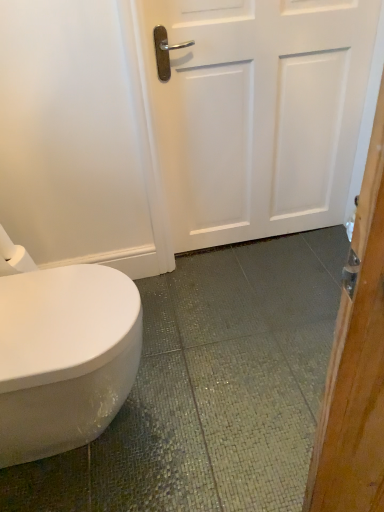
Describe the element at coordinates (13, 256) in the screenshot. I see `white matte toilet paper at left` at that location.

Find the location of a particular element. The image size is (384, 512). white matte toilet paper at left is located at coordinates (13, 256).

In order to face white matte toilet paper at left, should I rotate leftwards or rightwards?

Turn left by 24.403 degrees to look at white matte toilet paper at left.

Image resolution: width=384 pixels, height=512 pixels. What do you see at coordinates (257, 113) in the screenshot?
I see `white matte door at center` at bounding box center [257, 113].

In order to click on white matte door at center in this screenshot , I will do click(x=257, y=113).

This screenshot has height=512, width=384. I want to click on white matte toilet paper at left, so click(x=13, y=256).

Between white matte toilet paper at left and white matte door at center, which one appears on the left side from the viewer's perspective?

From the viewer's perspective, white matte toilet paper at left appears more on the left side.

Between white matte toilet paper at left and white matte door at center, which one is positioned in front?

white matte toilet paper at left.

Is point (17, 251) farther from camera compared to point (241, 99)?

No, (17, 251) is closer to viewer.

From the image's perspective, is white matte toilet paper at left located above or below white matte door at center?

Clearly, from the image's perspective, white matte toilet paper at left is below white matte door at center.

Consider the image. From a real-world perspective, is white matte toilet paper at left located beneath white matte door at center?

Yes, from a real-world perspective, white matte toilet paper at left is below white matte door at center.

Between white matte toilet paper at left and white matte door at center, which one has smaller width?

With smaller width is white matte toilet paper at left.

Is white matte toilet paper at left taller than white matte door at center?

Incorrect, the height of white matte toilet paper at left is not larger of that of white matte door at center.

Is white matte toilet paper at left bigger or smaller than white matte door at center?

Clearly, white matte toilet paper at left is smaller in size than white matte door at center.

Is white matte toilet paper at left positioned beyond the bounds of white matte door at center?

Yes, white matte toilet paper at left is not within white matte door at center.

Is white matte toilet paper at left far away from white matte door at center?

No.

Does white matte toilet paper at left turn towards white matte door at center?

No, white matte toilet paper at left is not oriented towards white matte door at center.

What's the angular difference between white matte toilet paper at left and white matte door at center's facing directions?

The angular difference between white matte toilet paper at left and white matte door at center is 0.736 degrees.

The image size is (384, 512). There is a white matte toilet paper at left. What are the coordinates of `door above it (from a real-world perspective)` in the screenshot? It's located at (257, 113).

Considering the positions of objects white matte door at center and white matte toilet paper at left in the image provided, who is more to the left, white matte door at center or white matte toilet paper at left?

Positioned to the left is white matte toilet paper at left.

Which object is more forward, white matte door at center or white matte toilet paper at left?

Positioned in front is white matte toilet paper at left.

Considering the positions of points (284, 229) and (27, 268), is point (284, 229) closer to camera compared to point (27, 268)?

No, (284, 229) is behind (27, 268).

From the image's perspective, is white matte door at center above or below white matte toilet paper at left?

white matte door at center is above white matte toilet paper at left.

From a real-world perspective, which is physically below, white matte door at center or white matte toilet paper at left?

In real-world perspective, white matte toilet paper at left is lower.

Considering the sizes of objects white matte door at center and white matte toilet paper at left in the image provided, who is thinner, white matte door at center or white matte toilet paper at left?

white matte toilet paper at left.

Is white matte door at center shorter than white matte toilet paper at left?

In fact, white matte door at center may be taller than white matte toilet paper at left.

From the picture: Which of these two, white matte door at center or white matte toilet paper at left, is bigger?

white matte door at center is bigger.

Can white matte toilet paper at left be found inside white matte door at center?

No, white matte toilet paper at left is not inside white matte door at center.

Is white matte door at center positioned far away from white matte toilet paper at left?

That's not correct — white matte door at center is a little close to white matte toilet paper at left.

Could you tell me if white matte door at center is facing white matte toilet paper at left?

No.

How many degrees apart are the facing directions of white matte door at center and white matte toilet paper at left?

white matte door at center and white matte toilet paper at left are facing 0.736 degrees away from each other.

From the picture: How much distance is there between white matte door at center and white matte toilet paper at left?

white matte door at center is 95.78 centimeters away from white matte toilet paper at left.

What are the coordinates of `door above the white matte toilet paper at left (from a real-world perspective)` in the screenshot? It's located at (257, 113).

Find the location of `door above the white matte toilet paper at left (from a real-world perspective)`. door above the white matte toilet paper at left (from a real-world perspective) is located at coordinates (257, 113).

You are a GUI agent. You are given a task and a screenshot of the screen. Output one action in this format:
    pyautogui.click(x=<x>, y=<y>)
    Task: Click on the door located behind the white matte toilet paper at left
    The height and width of the screenshot is (512, 384).
    Given the screenshot: What is the action you would take?
    pyautogui.click(x=257, y=113)